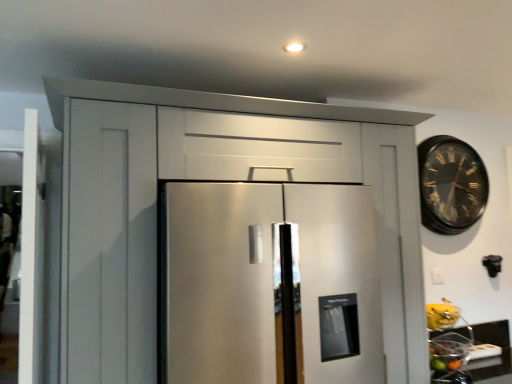
Describe the element at coordinates (451, 185) in the screenshot. This screenshot has width=512, height=384. I see `gold-toned metal clock at upper right` at that location.

Find the location of a particular element. This screenshot has height=384, width=512. gold-toned metal clock at upper right is located at coordinates (451, 185).

Measure the distance between point (414, 123) and camera.

The distance of point (414, 123) from camera is 7.13 feet.

Describe the element at coordinates (283, 116) in the screenshot. This screenshot has width=512, height=384. I see `satin white cabinet at center` at that location.

Locate an element on the screen. The width and height of the screenshot is (512, 384). stainless steel refrigerator at center is located at coordinates (270, 284).

The height and width of the screenshot is (384, 512). I want to click on gold-toned metal clock at upper right, so click(451, 185).

Is stainless steel refrigerator at center directly adjacent to matte black countertop at lower right?

No, stainless steel refrigerator at center is not next to matte black countertop at lower right.

Does point (253, 250) lie behind point (496, 377)?

No, (253, 250) is closer to viewer.

Is stainless steel refrigerator at center positioned with its back to matte black countertop at lower right?

That's not correct — stainless steel refrigerator at center is not looking away from matte black countertop at lower right.

Consider the image. From the image's perspective, which one is positioned higher, stainless steel refrigerator at center or matte black countertop at lower right?

stainless steel refrigerator at center.

Considering the relative sizes of shiny metallic bowl at lower right, the first fruit when ordered from bottom to top, and satin white cabinet at center in the image provided, is shiny metallic bowl at lower right, the first fruit when ordered from bottom to top, bigger than satin white cabinet at center?

Actually, shiny metallic bowl at lower right, the first fruit when ordered from bottom to top, might be smaller than satin white cabinet at center.

What's the angular difference between shiny metallic bowl at lower right, the first fruit when ordered from bottom to top, and satin white cabinet at center's facing directions?

7.76 degrees.

Could you tell me if shiny metallic bowl at lower right, the first fruit when ordered from bottom to top, is facing satin white cabinet at center?

Yes, shiny metallic bowl at lower right, the first fruit when ordered from bottom to top, is oriented towards satin white cabinet at center.

Is shiny metallic bowl at lower right, the first fruit when ordered from bottom to top, not close to satin white cabinet at center?

No, shiny metallic bowl at lower right, the first fruit when ordered from bottom to top, is not far from satin white cabinet at center.

Is yellow matte bananas at lower right, the first fruit in the top-to-bottom sequence, at the back of satin white cabinet at center?

satin white cabinet at center does not have its back to yellow matte bananas at lower right, the first fruit in the top-to-bottom sequence.

From a real-world perspective, is satin white cabinet at center physically above yellow matte bananas at lower right, the first fruit in the top-to-bottom sequence?

Yes.

Which of these two, satin white cabinet at center or yellow matte bananas at lower right, the 2th fruit when ordered from bottom to top, is bigger?

Bigger between the two is satin white cabinet at center.

Which object is further away from the camera, shiny metallic bowl at lower right, the first fruit when ordered from bottom to top, or matte black countertop at lower right?

matte black countertop at lower right is further from the camera.

Considering the relative sizes of shiny metallic bowl at lower right, which ranks as the second fruit in top-to-bottom order, and matte black countertop at lower right in the image provided, is shiny metallic bowl at lower right, which ranks as the second fruit in top-to-bottom order, thinner than matte black countertop at lower right?

Indeed, shiny metallic bowl at lower right, which ranks as the second fruit in top-to-bottom order, has a lesser width compared to matte black countertop at lower right.

From a real-world perspective, between shiny metallic bowl at lower right, the first fruit when ordered from bottom to top, and matte black countertop at lower right, who is vertically lower?

From a 3D spatial view, matte black countertop at lower right is below.

Which of these two, shiny metallic bowl at lower right, the first fruit when ordered from bottom to top, or matte black countertop at lower right, stands taller?

Standing taller between the two is matte black countertop at lower right.

Does gold-toned metal clock at upper right turn towards shiny metallic bowl at lower right, the first fruit when ordered from bottom to top?

No.

In terms of height, does gold-toned metal clock at upper right look taller or shorter compared to shiny metallic bowl at lower right, which ranks as the second fruit in top-to-bottom order?

Considering their sizes, gold-toned metal clock at upper right has more height than shiny metallic bowl at lower right, which ranks as the second fruit in top-to-bottom order.

Is gold-toned metal clock at upper right completely or partially outside of shiny metallic bowl at lower right, the first fruit when ordered from bottom to top?

That's correct, gold-toned metal clock at upper right is outside of shiny metallic bowl at lower right, the first fruit when ordered from bottom to top.

Could you tell me if matte black countertop at lower right is facing satin white cabinet at center?

No, matte black countertop at lower right does not turn towards satin white cabinet at center.

Can you confirm if matte black countertop at lower right is thinner than satin white cabinet at center?

Yes.

Are matte black countertop at lower right and satin white cabinet at center located far from each other?

They are positioned close to each other.

Considering the sizes of objects matte black countertop at lower right and satin white cabinet at center in the image provided, who is shorter, matte black countertop at lower right or satin white cabinet at center?

Standing shorter between the two is matte black countertop at lower right.

Which point is more forward, (430, 315) or (402, 322)?

The point (402, 322) is closer to the camera.

Is yellow matte bananas at lower right, the 2th fruit when ordered from bottom to top, at the right side of satin white cabinet at center?

Correct, you'll find yellow matte bananas at lower right, the 2th fruit when ordered from bottom to top, to the right of satin white cabinet at center.

From the image's perspective, does yellow matte bananas at lower right, the 2th fruit when ordered from bottom to top, appear higher than satin white cabinet at center?

Actually, yellow matte bananas at lower right, the 2th fruit when ordered from bottom to top, appears below satin white cabinet at center in the image.

Considering the relative sizes of yellow matte bananas at lower right, the first fruit in the top-to-bottom sequence, and satin white cabinet at center in the image provided, is yellow matte bananas at lower right, the first fruit in the top-to-bottom sequence, thinner than satin white cabinet at center?

Correct, the width of yellow matte bananas at lower right, the first fruit in the top-to-bottom sequence, is less than that of satin white cabinet at center.

Where is `appliance above the matte black countertop at lower right (from the image's perspective)`? This screenshot has width=512, height=384. appliance above the matte black countertop at lower right (from the image's perspective) is located at coordinates (270, 284).

Locate an element on the screen. This screenshot has height=384, width=512. cabinetry that appears on the left of shiny metallic bowl at lower right, which ranks as the second fruit in top-to-bottom order is located at coordinates (283, 116).

Estimate the real-world distances between objects in this image. Which object is further from satin white cabinet at center, shiny metallic bowl at lower right, the first fruit when ordered from bottom to top, or gold-toned metal clock at upper right?

Based on the image, shiny metallic bowl at lower right, the first fruit when ordered from bottom to top, appears to be further to satin white cabinet at center.

Which object lies nearer to the anchor point shiny metallic bowl at lower right, the first fruit when ordered from bottom to top, yellow matte bananas at lower right, the first fruit in the top-to-bottom sequence, or gold-toned metal clock at upper right?

yellow matte bananas at lower right, the first fruit in the top-to-bottom sequence, lies closer to shiny metallic bowl at lower right, the first fruit when ordered from bottom to top, than the other object.

Considering their positions, is shiny metallic bowl at lower right, the first fruit when ordered from bottom to top, positioned closer to satin white cabinet at center than yellow matte bananas at lower right, the 2th fruit when ordered from bottom to top?

Based on the image, shiny metallic bowl at lower right, the first fruit when ordered from bottom to top, appears to be nearer to satin white cabinet at center.

Looking at this image, when comparing their distances from stainless steel refrigerator at center, does shiny metallic bowl at lower right, which ranks as the second fruit in top-to-bottom order, or yellow matte bananas at lower right, the first fruit in the top-to-bottom sequence, seem closer?

shiny metallic bowl at lower right, which ranks as the second fruit in top-to-bottom order.

Which object lies further to the anchor point gold-toned metal clock at upper right, matte black countertop at lower right or shiny metallic bowl at lower right, the first fruit when ordered from bottom to top?

matte black countertop at lower right.

Considering their positions, is matte black countertop at lower right positioned closer to stainless steel refrigerator at center than gold-toned metal clock at upper right?

matte black countertop at lower right.

Based on their spatial positions, is matte black countertop at lower right or shiny metallic bowl at lower right, which ranks as the second fruit in top-to-bottom order, further from satin white cabinet at center?

matte black countertop at lower right is further to satin white cabinet at center.

When comparing their distances from satin white cabinet at center, does stainless steel refrigerator at center or matte black countertop at lower right seem closer?

Among the two, stainless steel refrigerator at center is located nearer to satin white cabinet at center.

Locate an element on the screen. This screenshot has height=384, width=512. clock between satin white cabinet at center and matte black countertop at lower right from left to right is located at coordinates (451, 185).

At what (x,y) coordinates should I click in order to perform the action: click on fruit between shiny metallic bowl at lower right, which ranks as the second fruit in top-to-bottom order, and matte black countertop at lower right. Please return your answer as a coordinate pair (x, y). This screenshot has width=512, height=384. Looking at the image, I should click on (441, 315).

Locate an element on the screen. appliance situated between satin white cabinet at center and yellow matte bananas at lower right, the 2th fruit when ordered from bottom to top, from left to right is located at coordinates (270, 284).

The image size is (512, 384). What are the coordinates of `fruit between satin white cabinet at center and yellow matte bananas at lower right, the first fruit in the top-to-bottom sequence, from left to right` in the screenshot? It's located at (446, 355).